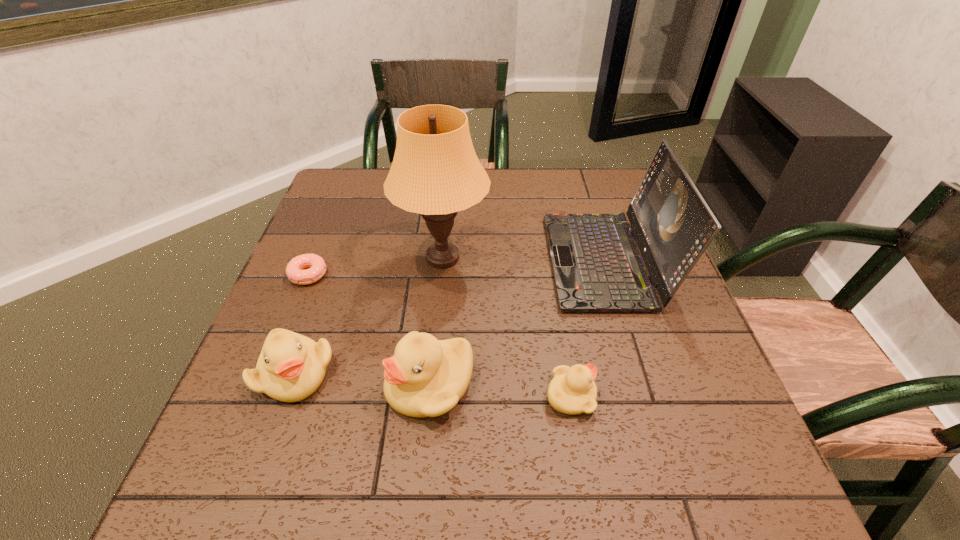
Locate an element on the screen. This screenshot has height=540, width=960. the second tallest duckling is located at coordinates (291, 367).

You are a GUI agent. You are given a task and a screenshot of the screen. Output one action in this format:
    pyautogui.click(x=<x>, y=<y>)
    Task: Click on the third shortest object
    
    Given the screenshot: What is the action you would take?
    pyautogui.click(x=291, y=367)

The image size is (960, 540). In order to click on the second duckling from right to left in this screenshot , I will do `click(426, 377)`.

Locate an element on the screen. Image resolution: width=960 pixels, height=540 pixels. the rightmost duckling is located at coordinates (572, 391).

Where is `the fifth tallest object`? This screenshot has height=540, width=960. the fifth tallest object is located at coordinates 572,391.

Identify the location of the tallest object. This screenshot has height=540, width=960. point(435,172).

Identify the location of the fifth shortest object. (597, 267).

The image size is (960, 540). Find the location of `the shortest object`. the shortest object is located at coordinates click(x=317, y=267).

You are a GUI agent. You are given a task and a screenshot of the screen. Output one action in this format:
    pyautogui.click(x=<x>, y=<y>)
    Task: Click on the vacant area situated on the front-facing side of the second duckling from right to left
    Image resolution: width=960 pixels, height=540 pixels.
    Given the screenshot: What is the action you would take?
    pyautogui.click(x=276, y=384)

The image size is (960, 540). Find the location of `vacant space located on the front-facing side of the second duckling from right to left`. vacant space located on the front-facing side of the second duckling from right to left is located at coordinates (287, 384).